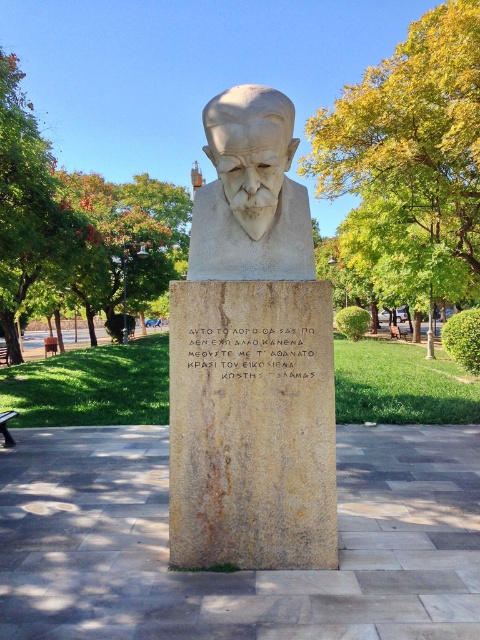
Is white stone bust at center bigger than wooden park bench at lower left?

Actually, white stone bust at center might be smaller than wooden park bench at lower left.

Image resolution: width=480 pixels, height=640 pixels. What do you see at coordinates (251, 193) in the screenshot? I see `white stone bust at center` at bounding box center [251, 193].

The width and height of the screenshot is (480, 640). In order to click on white stone bust at center in this screenshot , I will do `click(251, 193)`.

Who is shorter, wooden park bench at lower left or brown wooden park bench at center?

wooden park bench at lower left

What do you see at coordinates (6, 426) in the screenshot? I see `wooden park bench at lower left` at bounding box center [6, 426].

In order to click on wooden park bench at lower left in this screenshot , I will do `click(6, 426)`.

You are a GUI agent. You are given a task and a screenshot of the screen. Output one action in this format:
    pyautogui.click(x=<x>, y=<y>)
    Task: Click on the wooden park bench at lower left
    This screenshot has width=480, height=640.
    Given the screenshot: What is the action you would take?
    pyautogui.click(x=6, y=426)

Between matte stone bust at center and brown wooden bench at lower left, which one has more height?

matte stone bust at center is taller.

Is matte stone bust at center wider than brown wooden bench at lower left?

Indeed, matte stone bust at center has a greater width compared to brown wooden bench at lower left.

Is point (192, 412) less distant than point (8, 349)?

Yes, it is in front of point (8, 349).

Locate an element on the screen. matte stone bust at center is located at coordinates (251, 356).